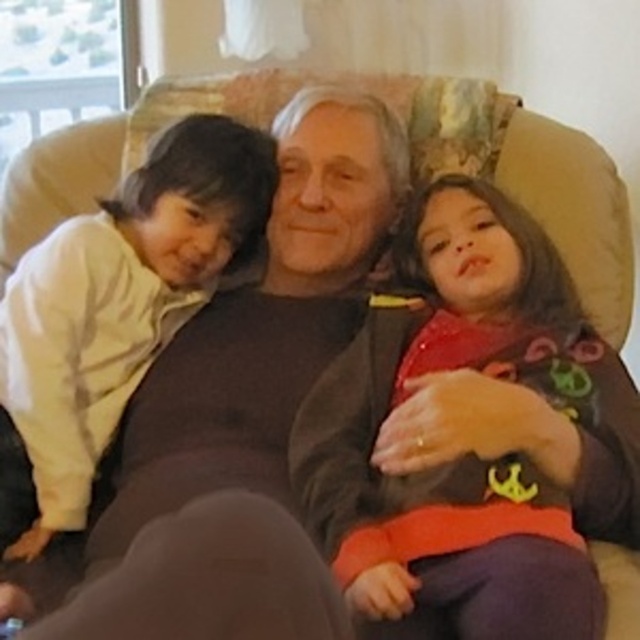
Who is taller, matte red sweater at center or light yellow fleece at left?

light yellow fleece at left

Is matte red sweater at center above light yellow fleece at left?

No.

Does point (609, 376) lie behind point (90, 248)?

That is False.

Identify the location of matte red sweater at center. This screenshot has width=640, height=640. (472, 454).